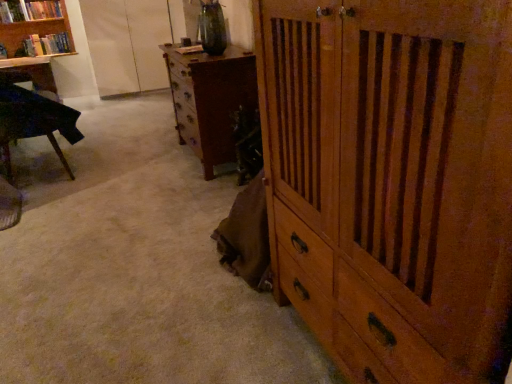
Question: Is wooden bookshelf at upper left positioned in front of wooden cabinet at center, which is the first chest of drawers in front-to-back order?

Choices:
 (A) no
 (B) yes

Answer: (A)

Question: Is wooden bookshelf at upper left next to wooden cabinet at center, which is the first chest of drawers in front-to-back order?

Choices:
 (A) yes
 (B) no

Answer: (B)

Question: Is wooden bookshelf at upper left to the left of wooden cabinet at center, positioned as the first chest of drawers in right-to-left order, from the viewer's perspective?

Choices:
 (A) yes
 (B) no

Answer: (A)

Question: Could you tell me if wooden bookshelf at upper left is facing wooden cabinet at center, which is the first chest of drawers in front-to-back order?

Choices:
 (A) yes
 (B) no

Answer: (A)

Question: Considering the relative sizes of wooden bookshelf at upper left and wooden cabinet at center, marked as the second chest of drawers in a left-to-right arrangement, in the image provided, is wooden bookshelf at upper left shorter than wooden cabinet at center, marked as the second chest of drawers in a left-to-right arrangement,?

Choices:
 (A) no
 (B) yes

Answer: (B)

Question: Is white fabric screen door at upper left bigger or smaller than hardcover book at upper left, which is the 1th book in top-to-bottom order?

Choices:
 (A) small
 (B) big

Answer: (B)

Question: From a real-world perspective, is white fabric screen door at upper left above or below hardcover book at upper left, arranged as the second book when ordered from the bottom?

Choices:
 (A) below
 (B) above

Answer: (A)

Question: Considering the positions of white fabric screen door at upper left and hardcover book at upper left, which is the 1th book in top-to-bottom order, in the image, is white fabric screen door at upper left wider or thinner than hardcover book at upper left, which is the 1th book in top-to-bottom order,?

Choices:
 (A) wide
 (B) thin

Answer: (A)

Question: Would you say white fabric screen door at upper left is inside or outside hardcover book at upper left, arranged as the second book when ordered from the bottom?

Choices:
 (A) inside
 (B) outside

Answer: (B)

Question: Relative to hardcover book at upper left, which is the second book from top to bottom, is wooden bookshelf at upper left in front or behind?

Choices:
 (A) front
 (B) behind

Answer: (A)

Question: In terms of width, does wooden bookshelf at upper left look wider or thinner when compared to hardcover book at upper left, which is the second book from top to bottom?

Choices:
 (A) wide
 (B) thin

Answer: (A)

Question: Based on their sizes in the image, would you say wooden bookshelf at upper left is bigger or smaller than hardcover book at upper left, the 1th book when ordered from bottom to top?

Choices:
 (A) small
 (B) big

Answer: (B)

Question: Does point (67, 16) appear closer or farther from the camera than point (69, 49)?

Choices:
 (A) closer
 (B) farther

Answer: (A)

Question: Would you say black glossy table at left is inside or outside brown wooden chest of drawers at center, which is counted as the second chest of drawers, starting from the front?

Choices:
 (A) outside
 (B) inside

Answer: (A)

Question: From a real-world perspective, is black glossy table at left above or below brown wooden chest of drawers at center, placed as the 2th chest of drawers when sorted from right to left?

Choices:
 (A) below
 (B) above

Answer: (A)